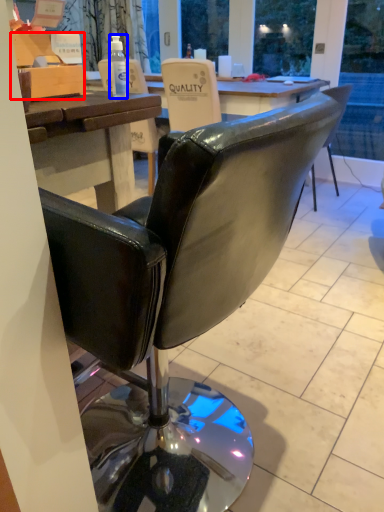
Question: Which object appears closest to the camera in this image, box (highlighted by a red box) or bottle (highlighted by a blue box)?

Choices:
 (A) box
 (B) bottle

Answer: (A)